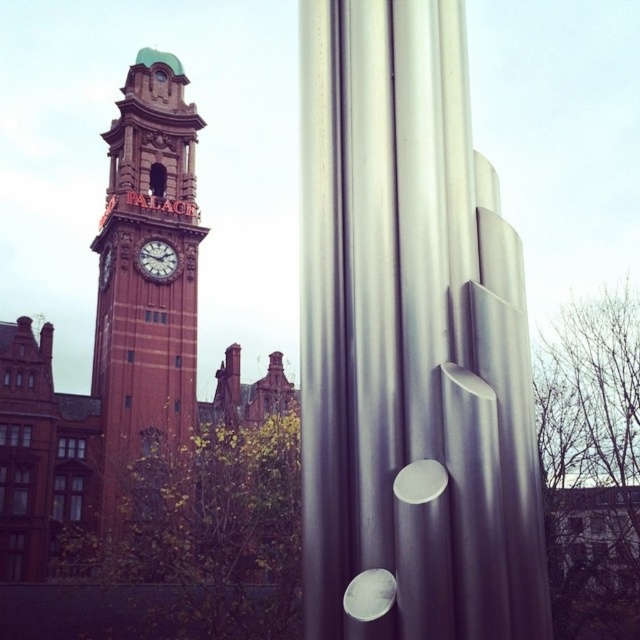
Can you confirm if red brick clock tower at left is positioned above matte red clock at center?

Correct, red brick clock tower at left is located above matte red clock at center.

Can you confirm if red brick clock tower at left is bigger than matte red clock at center?

Yes.

Between point (124, 131) and point (157, 256), which one is positioned in front?

Positioned in front is point (157, 256).

The image size is (640, 640). Find the location of `red brick clock tower at left`. red brick clock tower at left is located at coordinates (145, 275).